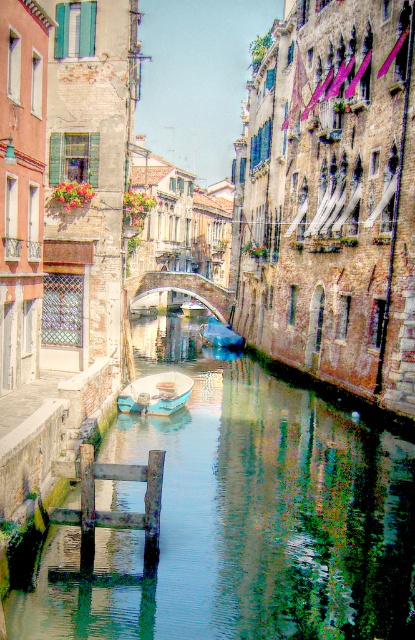
You are standing on the canal bridge and want to take a photo of the blue glossy boat at center. However, the greenish water at center is blocking your view. Can you move to the left or right to avoid the water and still see the boat?

The greenish water at center is closer to the viewer than blue glossy boat at center, so moving to the left or right might allow you to see around the water and still view the boat.

You are standing on a bridge overlooking the greenish water at center and the white plastic boat at center. Which object is nearer to you?

The greenish water at center is closer to the viewer than the white plastic boat at center.